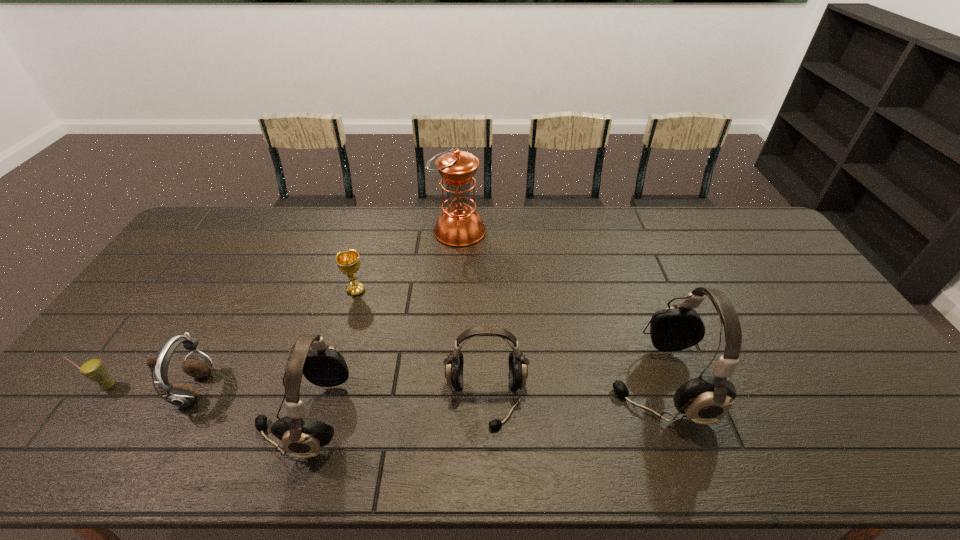
Locate which headset is the closest to the oil lamp. Please provide its 2D coordinates. Your answer should be formatted as a tuple, i.e. [(x, y)], where the tuple contains the x and y coordinates of a point satisfying the conditions above.

[(518, 370)]